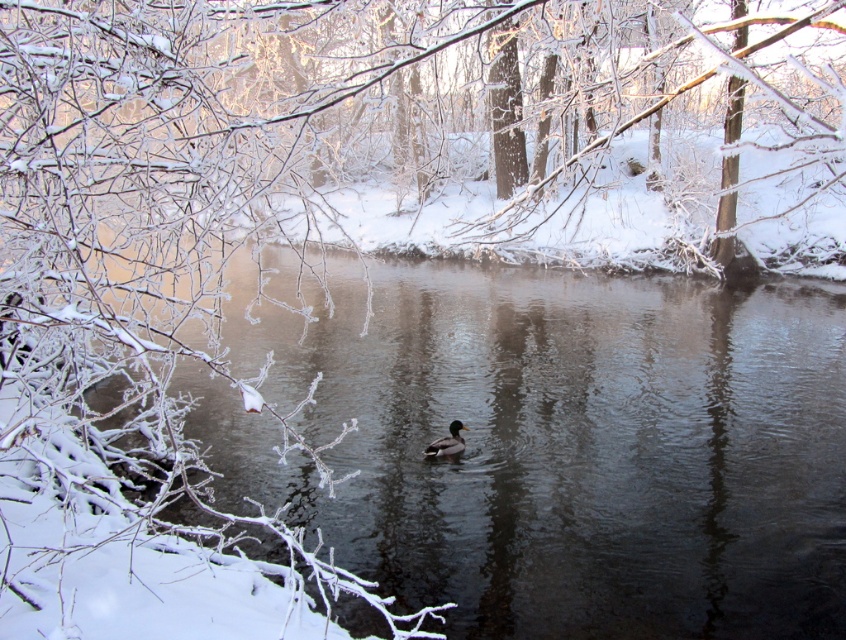
Question: Which point is farther to the camera?

Choices:
 (A) clear water at center
 (B) brown matte duck at center

Answer: (B)

Question: Is clear water at center bigger than brown matte duck at center?

Choices:
 (A) yes
 (B) no

Answer: (A)

Question: Can you confirm if clear water at center is bigger than brown matte duck at center?

Choices:
 (A) yes
 (B) no

Answer: (A)

Question: Does clear water at center appear on the left side of brown matte duck at center?

Choices:
 (A) yes
 (B) no

Answer: (A)